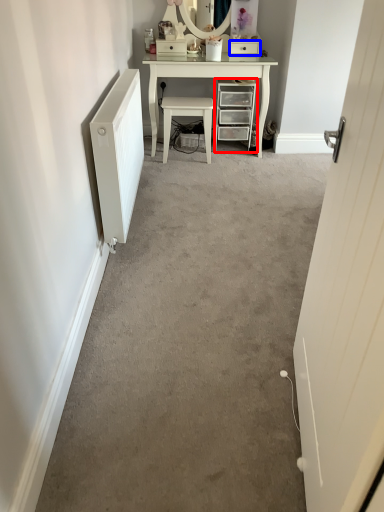
Question: Which of the following is the farthest to the observer, chest of drawers (highlighted by a red box) or drawer (highlighted by a blue box)?

Choices:
 (A) chest of drawers
 (B) drawer

Answer: (B)